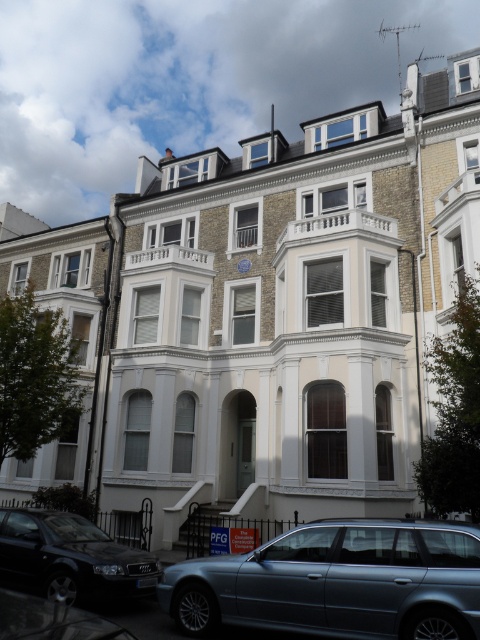
You are standing at the entrance of the central building and see two cars in front of you. Which car is positioned to the right side from your perspective? Please choose between the metallic silver car at lower center and the shiny silver car at lower left.

The metallic silver car at lower center is positioned to the right of the shiny silver car at lower left.

Please provide the coordinates of the black metallic car at lower left in the image.

The black metallic car at lower left is located at coordinates point (x=72, y=556).

You are standing in front of the row of buildings and want to determine which of the two points, point (x=414, y=632) or point (x=107, y=624), is closer to you. Which point is nearer?

Point (x=414, y=632) is further to the viewer than point (x=107, y=624), so the closer point is point (x=107, y=624).